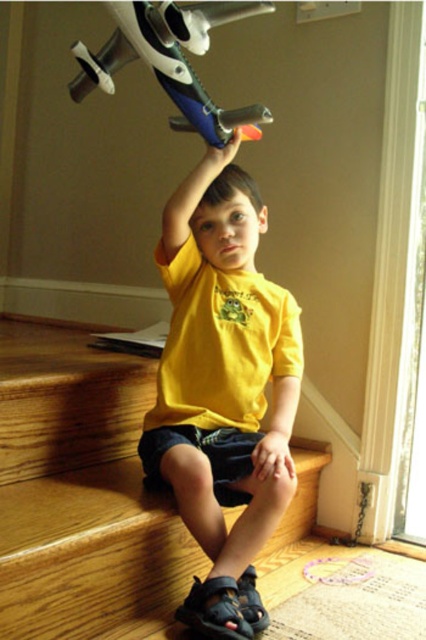
Question: Which is farther from the yellow matte shirt at upper center?

Choices:
 (A) matte plastic airplane at upper center
 (B) yellow matte shirt at center

Answer: (A)

Question: Which of these objects is positioned farthest from the yellow matte shirt at center?

Choices:
 (A) yellow matte shirt at upper center
 (B) matte plastic airplane at upper center

Answer: (B)

Question: Is the position of yellow matte shirt at upper center more distant than that of matte plastic airplane at upper center?

Choices:
 (A) yes
 (B) no

Answer: (A)

Question: Which point is closer to the camera?

Choices:
 (A) yellow matte shirt at upper center
 (B) yellow matte shirt at center
 (C) matte plastic airplane at upper center

Answer: (C)

Question: Can you confirm if yellow matte shirt at upper center is thinner than yellow matte shirt at center?

Choices:
 (A) no
 (B) yes

Answer: (A)

Question: Does yellow matte shirt at upper center lie in front of yellow matte shirt at center?

Choices:
 (A) yes
 (B) no

Answer: (A)